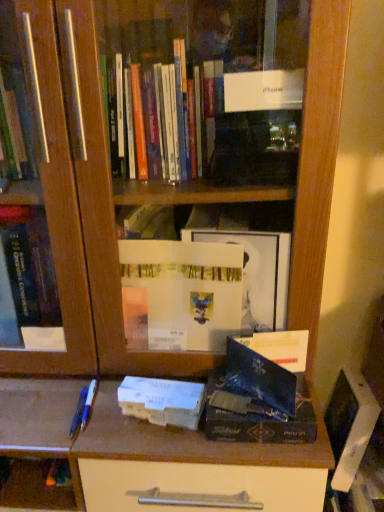
Question: From the image's perspective, is blue plastic pen at lower left, which ranks as the second pen in left-to-right order, under blue plastic pen at lower left, which is counted as the second pen, starting from the right?

Choices:
 (A) yes
 (B) no

Answer: (B)

Question: Is blue plastic pen at lower left, which ranks as the second pen in left-to-right order, located outside blue plastic pen at lower left, which is counted as the second pen, starting from the right?

Choices:
 (A) yes
 (B) no

Answer: (A)

Question: Does blue plastic pen at lower left, which ranks as the second pen in left-to-right order, have a smaller size compared to blue plastic pen at lower left, which is counted as the second pen, starting from the right?

Choices:
 (A) no
 (B) yes

Answer: (B)

Question: From a real-world perspective, does blue plastic pen at lower left, which is the first pen in right-to-left order, stand above blue plastic pen at lower left, which is counted as the second pen, starting from the right?

Choices:
 (A) no
 (B) yes

Answer: (A)

Question: Considering the relative sizes of blue plastic pen at lower left, which is the first pen in right-to-left order, and blue plastic pen at lower left, arranged as the 1th pen when viewed from the left, in the image provided, is blue plastic pen at lower left, which is the first pen in right-to-left order, thinner than blue plastic pen at lower left, arranged as the 1th pen when viewed from the left,?

Choices:
 (A) yes
 (B) no

Answer: (A)

Question: Is point (205, 433) closer or farther from the camera than point (69, 428)?

Choices:
 (A) closer
 (B) farther

Answer: (A)

Question: In the image, is shiny black book at center, arranged as the 2th paperback book when viewed from the left, positioned in front of or behind blue plastic pen at lower left, arranged as the 1th pen when viewed from the left?

Choices:
 (A) behind
 (B) front

Answer: (B)

Question: Considering the positions of shiny black book at center, which appears as the 1th paperback book when viewed from the right, and blue plastic pen at lower left, which is counted as the second pen, starting from the right, in the image, is shiny black book at center, which appears as the 1th paperback book when viewed from the right, taller or shorter than blue plastic pen at lower left, which is counted as the second pen, starting from the right,?

Choices:
 (A) short
 (B) tall

Answer: (B)

Question: From the image's perspective, is shiny black book at center, which appears as the 1th paperback book when viewed from the right, positioned above or below blue plastic pen at lower left, which is counted as the second pen, starting from the right?

Choices:
 (A) above
 (B) below

Answer: (A)

Question: From the image's perspective, is white matte paperback book at center, which ranks as the 1th paperback book in left-to-right order, located above or below blue plastic pen at lower left, which is the first pen in right-to-left order?

Choices:
 (A) below
 (B) above

Answer: (B)

Question: Is white matte paperback book at center, which is counted as the 2th paperback book, starting from the right, taller or shorter than blue plastic pen at lower left, which is the first pen in right-to-left order?

Choices:
 (A) short
 (B) tall

Answer: (B)

Question: Does point (155, 399) appear closer or farther from the camera than point (89, 395)?

Choices:
 (A) closer
 (B) farther

Answer: (A)

Question: Considering the positions of white matte paperback book at center, which ranks as the 1th paperback book in left-to-right order, and blue plastic pen at lower left, which is the first pen in right-to-left order, in the image, is white matte paperback book at center, which ranks as the 1th paperback book in left-to-right order, bigger or smaller than blue plastic pen at lower left, which is the first pen in right-to-left order,?

Choices:
 (A) small
 (B) big

Answer: (B)

Question: Looking at their shapes, would you say shiny black book at center, arranged as the 2th paperback book when viewed from the left, is wider or thinner than white matte paperback book at center, which is counted as the 2th paperback book, starting from the right?

Choices:
 (A) thin
 (B) wide

Answer: (B)

Question: In the image, is shiny black book at center, which appears as the 1th paperback book when viewed from the right, on the left side or the right side of white matte paperback book at center, which ranks as the 1th paperback book in left-to-right order?

Choices:
 (A) left
 (B) right

Answer: (B)